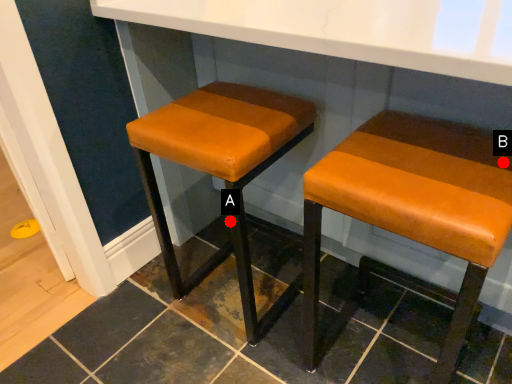
Question: Two points are circled on the image, labeled by A and B beside each circle. Among these points, which one is farthest from the camera?

Choices:
 (A) A is further
 (B) B is further

Answer: (A)